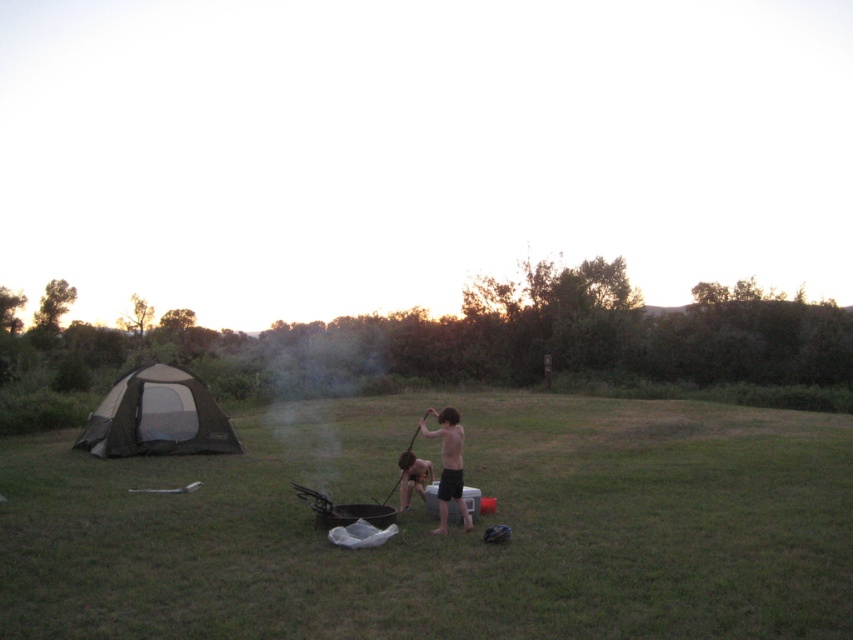
Question: Which of the following is the closest to the observer?

Choices:
 (A) (440, 509)
 (B) (281, 452)
 (C) (126, 401)

Answer: (A)

Question: Among these points, which one is nearest to the camera?

Choices:
 (A) (782, 554)
 (B) (451, 497)
 (C) (108, 445)

Answer: (A)

Question: Does black matte grill at center have a greater width compared to shiny black shorts at center?

Choices:
 (A) no
 (B) yes

Answer: (B)

Question: Is black mesh tent at left wider than shiny black shorts at center?

Choices:
 (A) no
 (B) yes

Answer: (B)

Question: Can you confirm if black matte grill at center is positioned above black mesh tent at left?

Choices:
 (A) yes
 (B) no

Answer: (B)

Question: Which object appears closest to the camera in this image?

Choices:
 (A) black matte grill at center
 (B) black mesh tent at left

Answer: (A)